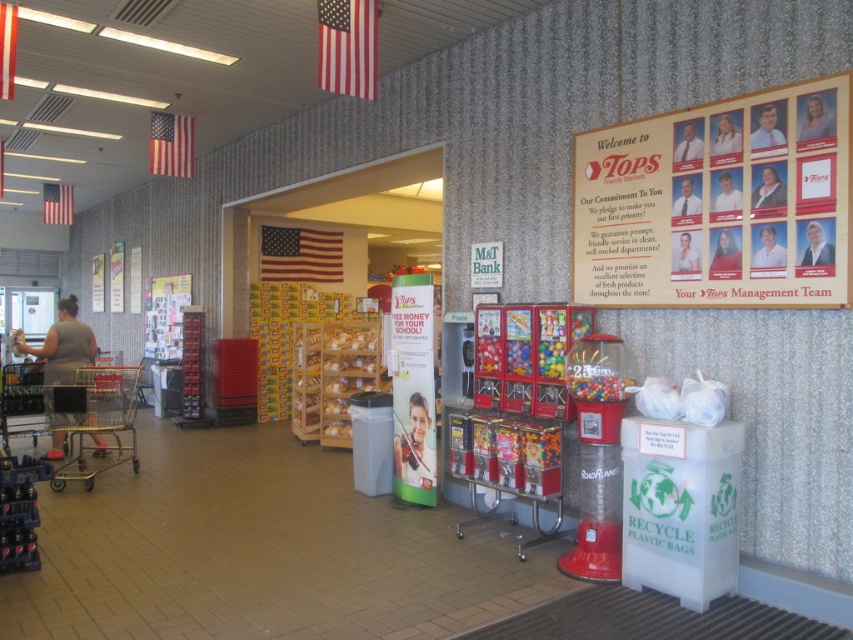
Question: Which point is closer to the camera taking this photo?

Choices:
 (A) (697, 176)
 (B) (97, 436)
 (C) (51, 390)

Answer: (A)

Question: Is wooden framed poster at upper right to the left of gray fabric shirt at left from the viewer's perspective?

Choices:
 (A) yes
 (B) no

Answer: (B)

Question: Which of these objects is positioned closest to the gold metallic shopping cart at left?

Choices:
 (A) gray fabric shirt at left
 (B) wooden framed poster at upper right

Answer: (A)

Question: Which of these objects is positioned closest to the gray fabric shirt at left?

Choices:
 (A) gold metallic shopping cart at left
 (B) wooden framed poster at upper right

Answer: (A)

Question: Is wooden framed poster at upper right below gray fabric shirt at left?

Choices:
 (A) yes
 (B) no

Answer: (B)

Question: Can you confirm if gold metallic shopping cart at left is thinner than gray fabric shirt at left?

Choices:
 (A) yes
 (B) no

Answer: (B)